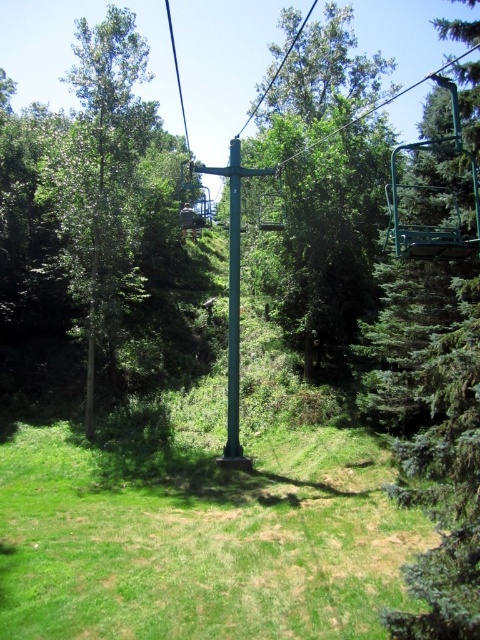
Does green grassy at center have a lesser height compared to green matte pole at center?

Correct, green grassy at center is not as tall as green matte pole at center.

Is the position of green grassy at center less distant than that of green matte pole at center?

Yes, it is in front of green matte pole at center.

Who is more distant from viewer, [200,477] or [228,403]?

Positioned behind is point [228,403].

Find the location of a particular element. The image size is (480, 640). green grassy at center is located at coordinates (201, 541).

Who is positioned more to the right, green leafy tree at center or green leafy tree at left?

From the viewer's perspective, green leafy tree at center appears more on the right side.

Which is in front, point (343, 364) or point (76, 164)?

Point (76, 164)

Locate an element on the screen. This screenshot has width=480, height=640. green leafy tree at center is located at coordinates (325, 188).

This screenshot has width=480, height=640. Find the location of `green leafy tree at center`. green leafy tree at center is located at coordinates (325, 188).

Is green grassy at center taller than green leafy tree at center?

No, green grassy at center is not taller than green leafy tree at center.

Looking at this image, is green grassy at center above green leafy tree at center?

No, green grassy at center is not above green leafy tree at center.

Which is in front, point (85, 467) or point (310, 260)?

Point (85, 467) is in front.

I want to click on green grassy at center, so click(201, 541).